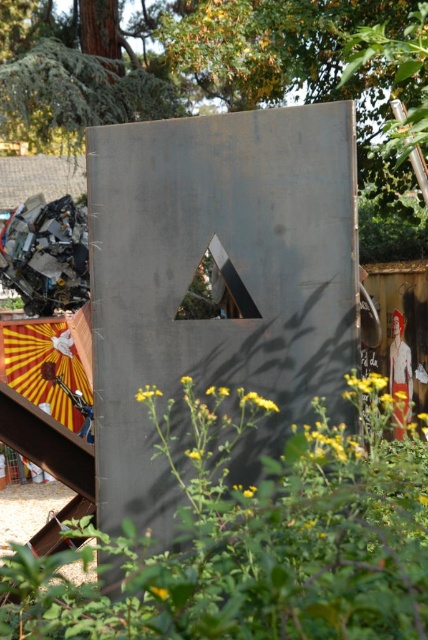
You are standing in front of the large metallic structure and notice the green matte plant at center and the white matte dress at right. Which object is positioned closer to your left side?

The green matte plant at center is to the left of the white matte dress at right, so it is closer to your left side.

Based on the photo, you are standing in the scene and want to take a photo of the white matte dress at right. To avoid the yellow striped fabric umbrella at lower left appearing in the photo, should you move closer to or farther away from the dress?

The yellow striped fabric umbrella at lower left is larger in size than the white matte dress at right. To avoid the umbrella appearing in the photo, you should move closer to the white matte dress at right. This reduces the field of view, making it easier to frame the dress without the umbrella in the shot.